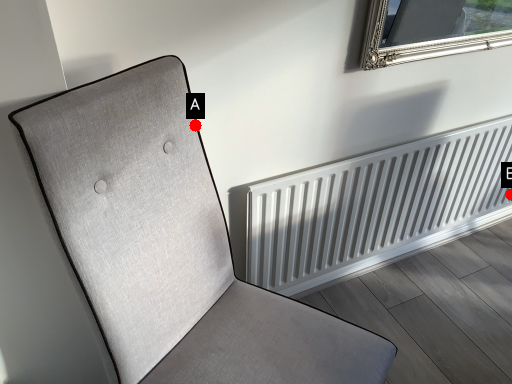
Question: Two points are circled on the image, labeled by A and B beside each circle. Among these points, which one is nearest to the camera?

Choices:
 (A) A is closer
 (B) B is closer

Answer: (A)